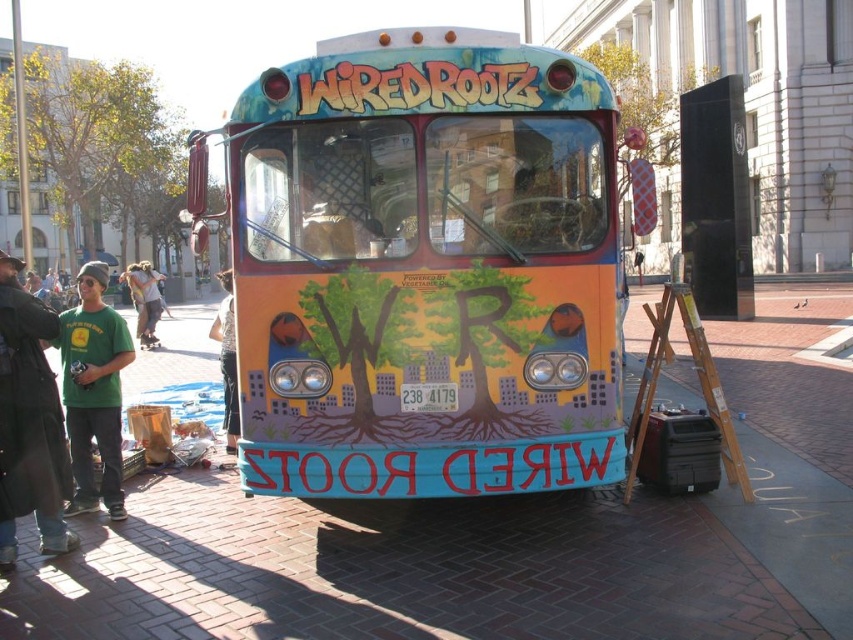
Which is more to the left, brick pavement at center or green cotton t-shirt at left?

green cotton t-shirt at left

Does brick pavement at center have a smaller size compared to green cotton t-shirt at left?

No.

The width and height of the screenshot is (853, 640). In order to click on brick pavement at center in this screenshot , I will do tap(451, 564).

This screenshot has width=853, height=640. In order to click on brick pavement at center in this screenshot , I will do `click(451, 564)`.

Who is shorter, green cotton shirt at left or green cotton t-shirt at left?

With less height is green cotton t-shirt at left.

Does point (3, 326) lie in front of point (103, 316)?

Yes.

Identify the location of green cotton shirt at left. (28, 422).

Describe the element at coordinates (422, 268) in the screenshot. The image size is (853, 640). I see `matte painted bus at center` at that location.

Can you confirm if matte painted bus at center is positioned to the left of light brown leather jacket at center?

Incorrect, matte painted bus at center is not on the left side of light brown leather jacket at center.

Describe the element at coordinates (422, 268) in the screenshot. I see `matte painted bus at center` at that location.

Find the location of a particular element. matte painted bus at center is located at coordinates (422, 268).